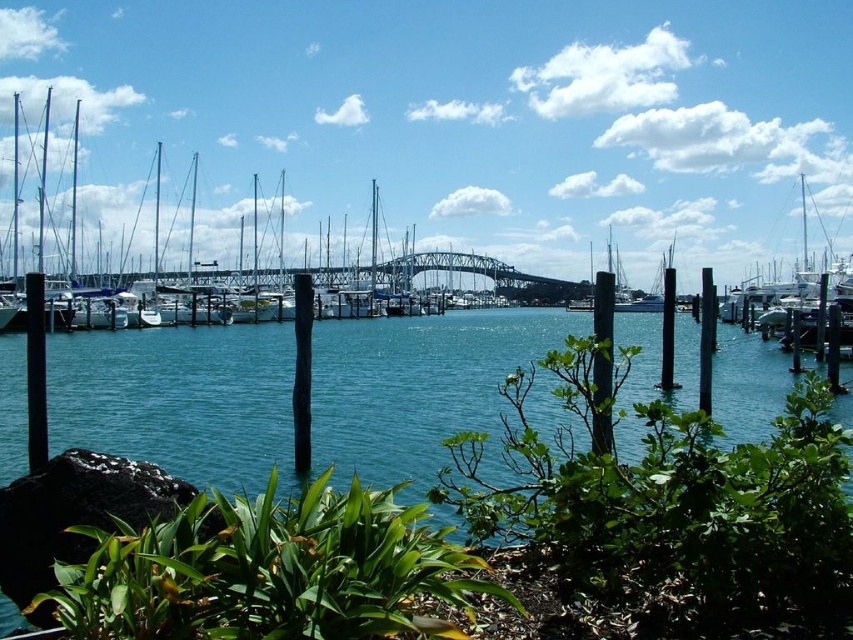
Question: Considering the real-world distances, which object is closest to the black wood pole at center?

Choices:
 (A) black matte pole at left
 (B) metallic silver sailboat at right
 (C) clear blue water at center
 (D) black wood post at center

Answer: (D)

Question: Does clear blue water at center have a greater width compared to black wood post at center?

Choices:
 (A) no
 (B) yes

Answer: (B)

Question: Is black matte pole at left to the left of black wood post at center from the viewer's perspective?

Choices:
 (A) no
 (B) yes

Answer: (B)

Question: Which point is closer to the camera taking this photo?

Choices:
 (A) (791, 304)
 (B) (538, 337)
 (C) (602, 445)
 (D) (36, 362)

Answer: (C)

Question: Which point is farther to the camera?

Choices:
 (A) metallic silver sailboat at right
 (B) black wood pole at center
 (C) clear blue water at center

Answer: (A)

Question: Is metallic silver sailboat at right in front of black matte pole at left?

Choices:
 (A) no
 (B) yes

Answer: (A)